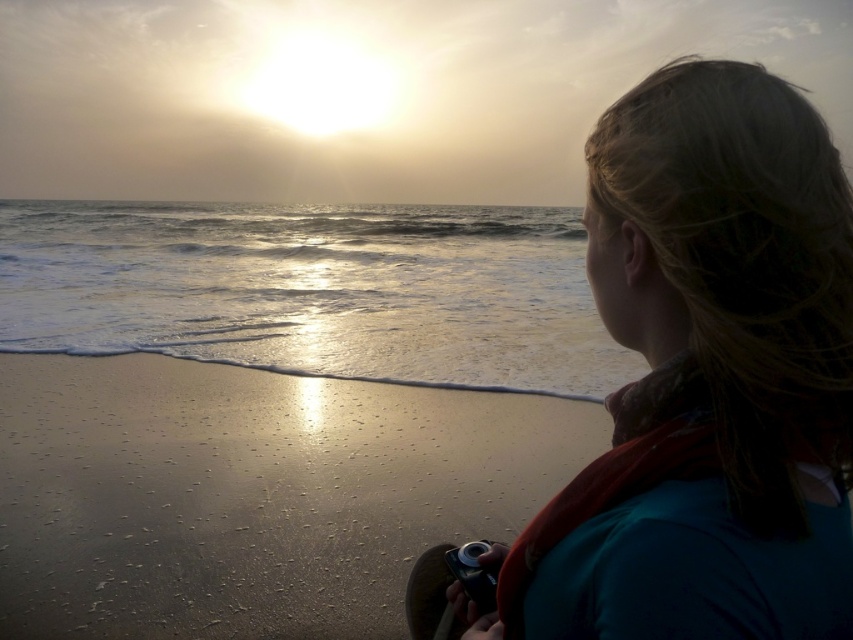
In the scene shown: You are standing at the point labeled as point (250, 493) in the image, which is the sandy beach at lower left. You want to walk towards the person sitting on the beach. In which direction should you go?

The sandy beach at lower left is where you are standing. The person is sitting on the sandy beach further away from the lower left towards the center. Therefore, you should walk towards the center of the image to reach the person.

You are standing on the beach and want to take a photo of the sunset using the black plastic camera at lower center. To frame the scene properly, you need to position the teal fabric shirt at center in the shot. Where should you place the shirt relative to the camera?

The teal fabric shirt at center should be placed to the right of the black plastic camera at lower center to capture it in the photo.